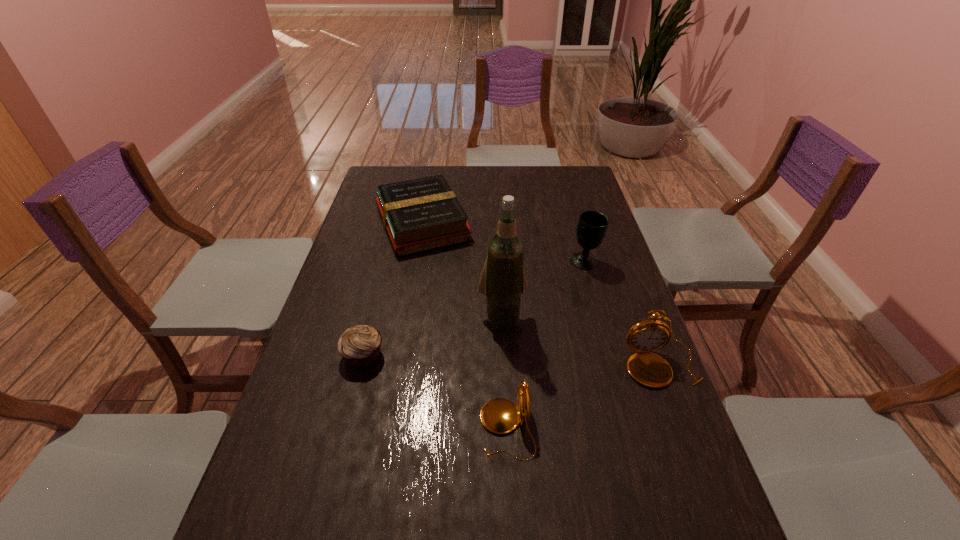
The height and width of the screenshot is (540, 960). What are the coordinates of `chalice present at the right edge` in the screenshot? It's located at click(x=592, y=226).

Identify the location of object positioned at the far left corner. [x=419, y=215].

Where is `free location at the far edge of the desktop`? This screenshot has width=960, height=540. free location at the far edge of the desktop is located at coordinates (540, 190).

Locate an element on the screen. vacant space at the left edge of the desktop is located at coordinates (374, 212).

This screenshot has height=540, width=960. What are the coordinates of `vacant space at the right edge of the desktop` in the screenshot? It's located at (581, 276).

This screenshot has width=960, height=540. Identify the location of empty space between the wine bottle and the hardback book. [x=462, y=270].

The width and height of the screenshot is (960, 540). What are the coordinates of `vacant space that's between the farther pocket watch and the muffin` in the screenshot? It's located at (512, 360).

The height and width of the screenshot is (540, 960). In order to click on free spot between the wine bottle and the muffin in this screenshot , I will do `click(432, 336)`.

Find the location of `unoccupied position between the hardback book and the muffin`. unoccupied position between the hardback book and the muffin is located at coordinates (393, 289).

You are a GUI agent. You are given a task and a screenshot of the screen. Output one action in this format:
    pyautogui.click(x=<x>, y=<y>)
    Task: Click on the free spot between the hardback book and the muffin
    The image size is (960, 540).
    Given the screenshot: What is the action you would take?
    pyautogui.click(x=393, y=289)